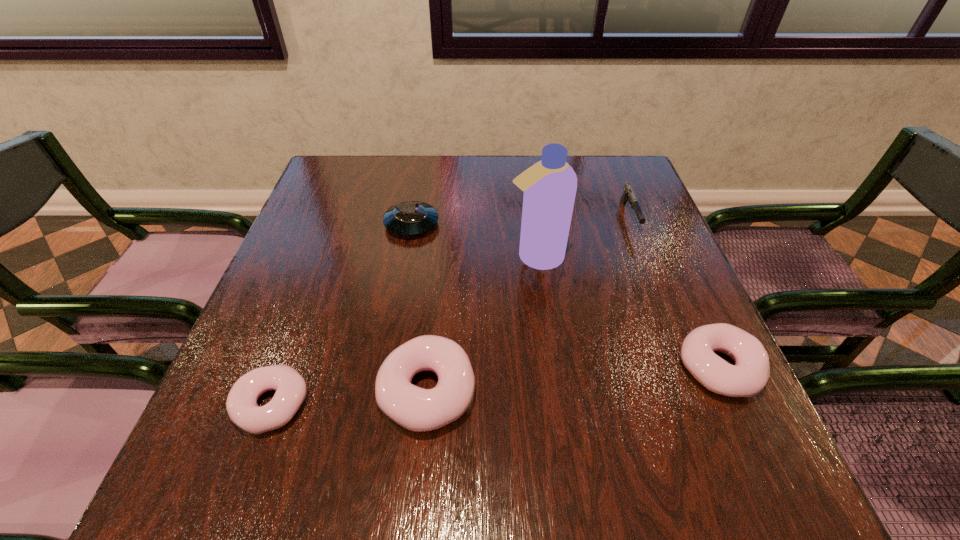
The image size is (960, 540). What are the coordinates of `the shortest doughnut` in the screenshot? It's located at (291, 389).

This screenshot has height=540, width=960. In order to click on the leftmost object in this screenshot , I will do click(291, 389).

Identify the location of the second doughnut from left to right. (417, 409).

I want to click on the rightmost doughnut, so click(x=748, y=376).

I want to click on gun, so click(628, 195).

Where is `saucer`? saucer is located at coordinates (410, 218).

Identify the location of the tallest object. This screenshot has height=540, width=960. (550, 185).

Identify the location of the fourth object from left to right. (550, 185).

Identify the location of free space located 0.100m on the back of the leftmost object. The width and height of the screenshot is (960, 540). (299, 330).

The height and width of the screenshot is (540, 960). I want to click on vacant space located 0.400m on the right of the second doughnut from left to right, so click(702, 392).